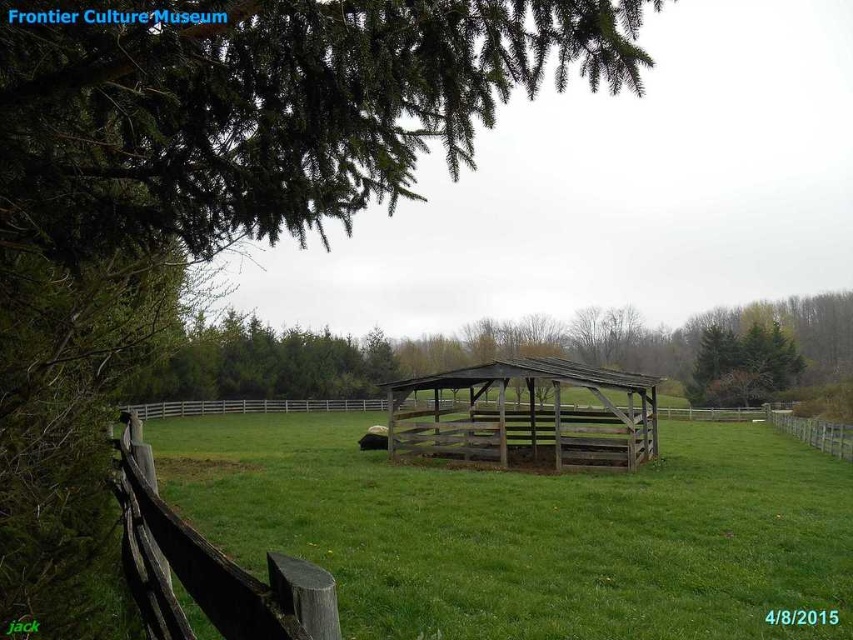
Is green grassy field at center in front of brown wooden fence at center?

Yes, it is.

Looking at this image, between green grassy field at center and brown wooden fence at center, which one has more height?

With more height is brown wooden fence at center.

Does point (474, 628) come closer to viewer compared to point (792, 426)?

Yes, it is.

Find the location of a particular element. The image size is (853, 640). green grassy field at center is located at coordinates (x=529, y=531).

Find the location of a particular element. The image size is (853, 640). weathered wood gazebo at center is located at coordinates (526, 417).

Can you confirm if weathered wood gazebo at center is positioned below brown wooden fence at center?

Actually, weathered wood gazebo at center is above brown wooden fence at center.

You are a GUI agent. You are given a task and a screenshot of the screen. Output one action in this format:
    pyautogui.click(x=<x>, y=<y>)
    Task: Click on the weathered wood gazebo at center
    The width and height of the screenshot is (853, 640).
    Given the screenshot: What is the action you would take?
    pyautogui.click(x=526, y=417)

This screenshot has width=853, height=640. I want to click on weathered wood gazebo at center, so click(x=526, y=417).

Can you confirm if green wood tree at center is positioned above weathered wood gazebo at center?

Indeed, green wood tree at center is positioned over weathered wood gazebo at center.

This screenshot has width=853, height=640. Describe the element at coordinates (474, 352) in the screenshot. I see `green wood tree at center` at that location.

Between point (825, 371) and point (527, 369), which one is positioned behind?

Positioned behind is point (825, 371).

The width and height of the screenshot is (853, 640). In order to click on green wood tree at center in this screenshot , I will do `click(474, 352)`.